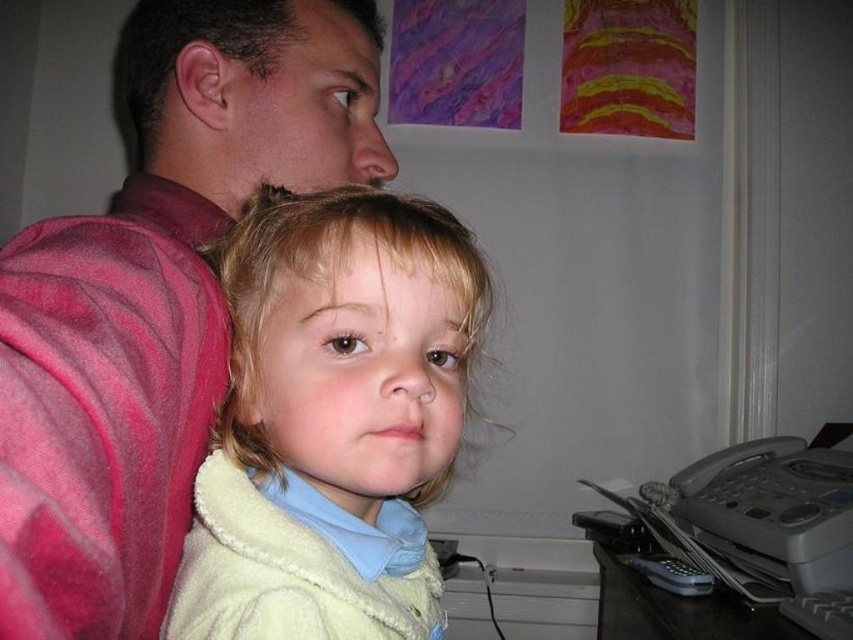
Between point (329, 488) and point (65, 522), which one is positioned in front?

Point (65, 522) is more forward.

This screenshot has width=853, height=640. What are the coordinates of `fluffy yellow jacket at center` in the screenshot? It's located at (332, 420).

Based on the photo, who is lower down, matte pink shirt at upper left or fluffy yellow jacket at center?

Positioned lower is fluffy yellow jacket at center.

Does point (262, 161) lie behind point (393, 600)?

Yes, point (262, 161) is farther from viewer.

Image resolution: width=853 pixels, height=640 pixels. In order to click on matte pink shirt at upper left in this screenshot , I will do `click(157, 298)`.

Between matte pink shirt at upper left and velvety pink robe at left, which one is positioned lower?

velvety pink robe at left is below.

What do you see at coordinates (157, 298) in the screenshot?
I see `matte pink shirt at upper left` at bounding box center [157, 298].

Between point (25, 554) and point (141, 531), which one is positioned in front?

Point (25, 554)

You are a GUI agent. You are given a task and a screenshot of the screen. Output one action in this format:
    pyautogui.click(x=<x>, y=<y>)
    Task: Click on the matte pink shirt at upper left
    Image resolution: width=853 pixels, height=640 pixels.
    Given the screenshot: What is the action you would take?
    pyautogui.click(x=157, y=298)